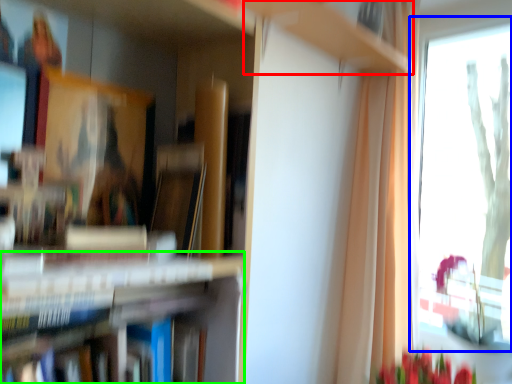
Question: Which object is positioned closest to cabinet (highlighted by a red box)? Select from window (highlighted by a blue box) and bookshelf (highlighted by a green box).

Choices:
 (A) window
 (B) bookshelf

Answer: (B)